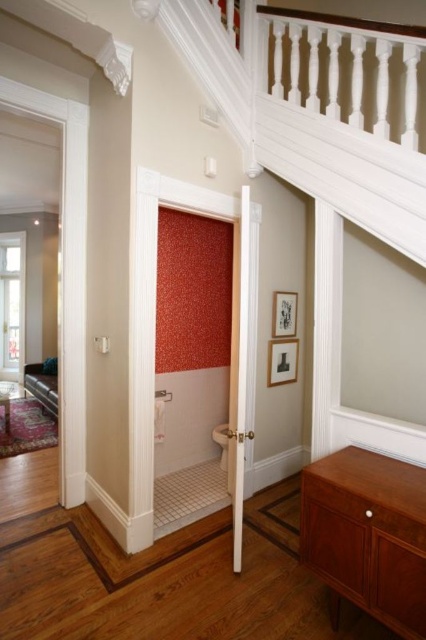
Question: Which object appears closest to the camera in this image?

Choices:
 (A) white textured stair at upper center
 (B) matte brown cabinet at lower right

Answer: (B)

Question: Is white textured stair at upper center bigger than matte brown cabinet at lower right?

Choices:
 (A) yes
 (B) no

Answer: (A)

Question: Does white textured stair at upper center appear on the right side of matte brown cabinet at lower right?

Choices:
 (A) no
 (B) yes

Answer: (A)

Question: Is the position of white textured stair at upper center less distant than that of matte brown cabinet at lower right?

Choices:
 (A) no
 (B) yes

Answer: (A)

Question: Which point is closer to the camera taking this photo?

Choices:
 (A) (317, 470)
 (B) (385, 92)

Answer: (A)